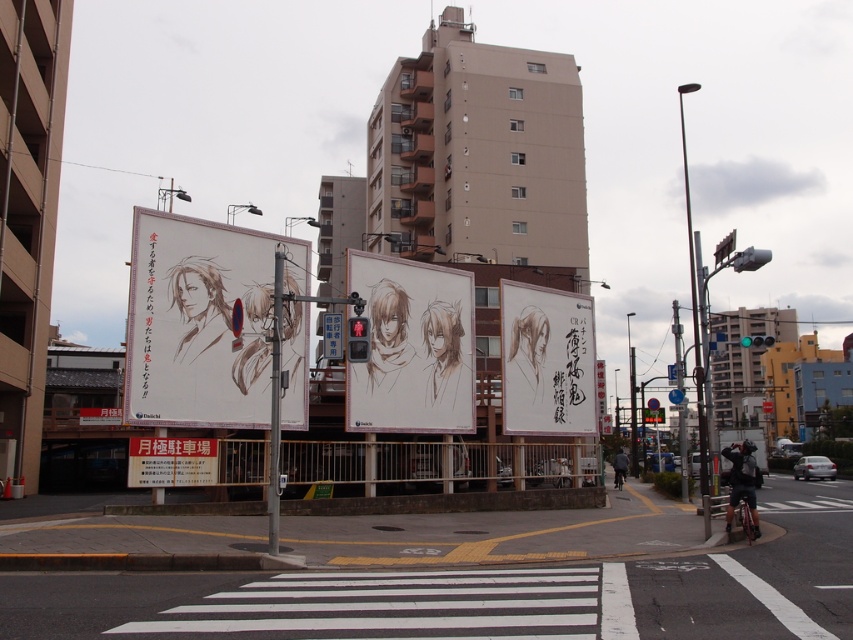
You are standing at the intersection and want to know how far the point at coordinates (170, 244) is from you. Can you determine the distance?

The distance of point (170, 244) from viewer is 54.85 feet.

You are a street artist planning to create a new mural that matches the existing artwork on the billboard. The billboard has two elements, a matte paper poster at center and a brown sketch at center. Which element should you make taller in your design to stay consistent with the original?

The matte paper poster at center should be made taller than the brown sketch at center in your design to stay consistent with the original.

You are a pedestrian standing at the intersection and want to read both the white paper sign at lower left and the dark gray jacket at lower right. Which object should you look at first to the left?

The white paper sign at lower left is positioned on the left side of dark gray jacket at lower right, so you should look at the white paper sign at lower left first.